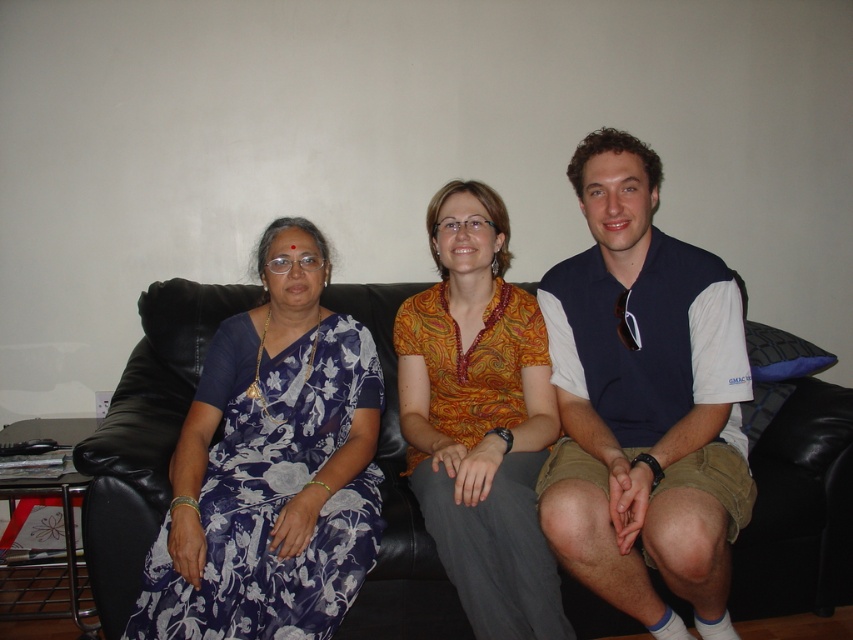
Which is behind, point (361, 413) or point (621, 305)?

The point (361, 413) is more distant.

Is blue floral sari at left thinner than black plastic goggles at center?

No.

Does point (227, 627) come closer to viewer compared to point (624, 344)?

Yes.

Locate an element on the screen. Image resolution: width=853 pixels, height=640 pixels. blue floral sari at left is located at coordinates [x=271, y=467].

Between black leather couch at center and blue floral sari at left, which one has more height?

With more height is blue floral sari at left.

Between point (167, 492) and point (267, 580), which one is positioned behind?

The point (167, 492) is more distant.

Where is `black leather couch at center`? This screenshot has height=640, width=853. black leather couch at center is located at coordinates (144, 435).

Between blue cotton polo shirt at center and black leather couch at center, which one appears on the right side from the viewer's perspective?

From the viewer's perspective, black leather couch at center appears more on the right side.

At what (x,y) coordinates should I click in order to perform the action: click on blue cotton polo shirt at center. Please return your answer as a coordinate pair (x, y). This screenshot has width=853, height=640. Looking at the image, I should click on (643, 401).